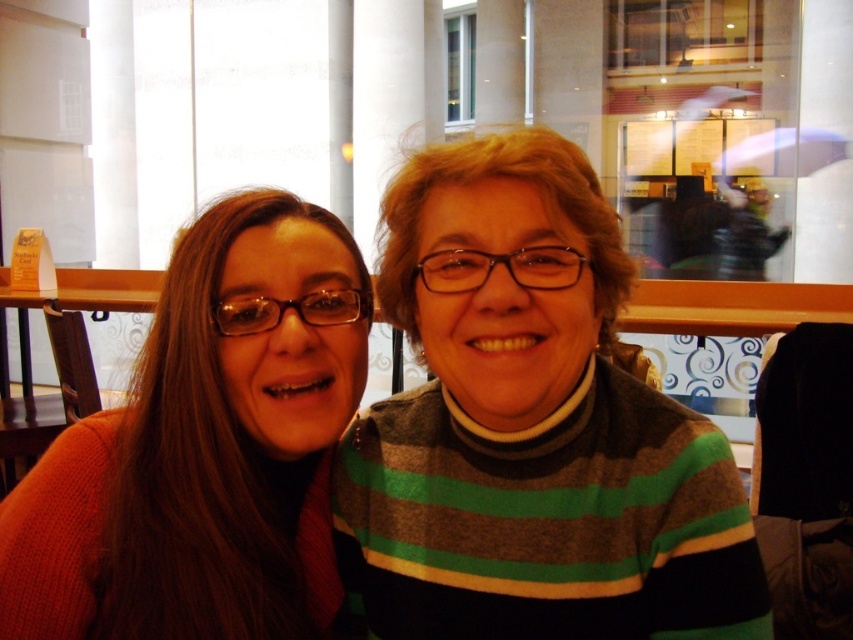
Question: Does striped sweater at center have a smaller size compared to knitted orange sweater at left?

Choices:
 (A) yes
 (B) no

Answer: (B)

Question: Which point is farther to the camera?

Choices:
 (A) (456, 250)
 (B) (317, 288)

Answer: (B)

Question: Does striped sweater at center have a larger size compared to knitted orange sweater at left?

Choices:
 (A) no
 (B) yes

Answer: (B)

Question: Can you confirm if striped sweater at center is bigger than knitted orange sweater at left?

Choices:
 (A) yes
 (B) no

Answer: (A)

Question: Which object appears closest to the camera in this image?

Choices:
 (A) knitted orange sweater at left
 (B) striped sweater at center

Answer: (B)